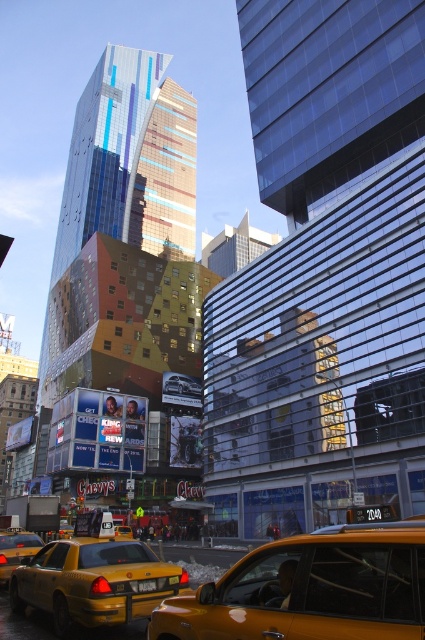
Question: Does yellow glossy taxi at center have a larger size compared to yellow matte taxi cab at lower left?

Choices:
 (A) no
 (B) yes

Answer: (A)

Question: Can you confirm if yellow rubber taxi at center is wider than metallic silver car at center?

Choices:
 (A) yes
 (B) no

Answer: (A)

Question: Which object appears farthest from the camera in this image?

Choices:
 (A) yellow glossy taxi at center
 (B) yellow rubber taxi at center

Answer: (B)

Question: Does yellow glossy taxi at center appear on the right side of metallic silver car at center?

Choices:
 (A) no
 (B) yes

Answer: (B)

Question: Which point is farther to the camera?

Choices:
 (A) yellow glossy taxi at center
 (B) metallic silver car at center

Answer: (B)

Question: Which point is closer to the camera?

Choices:
 (A) yellow rubber taxi at center
 (B) metallic silver car at center
 (C) yellow rubber taxi cab at lower left

Answer: (A)